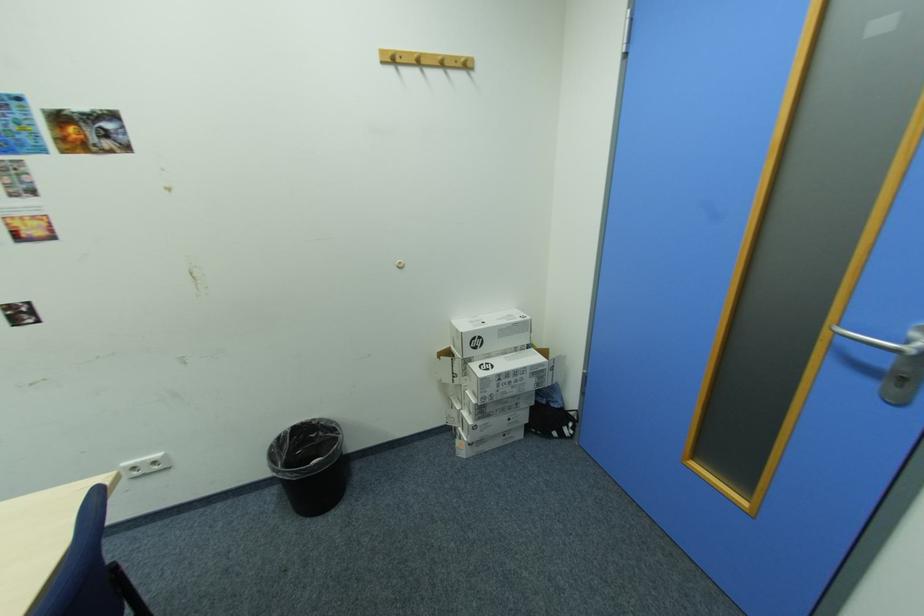
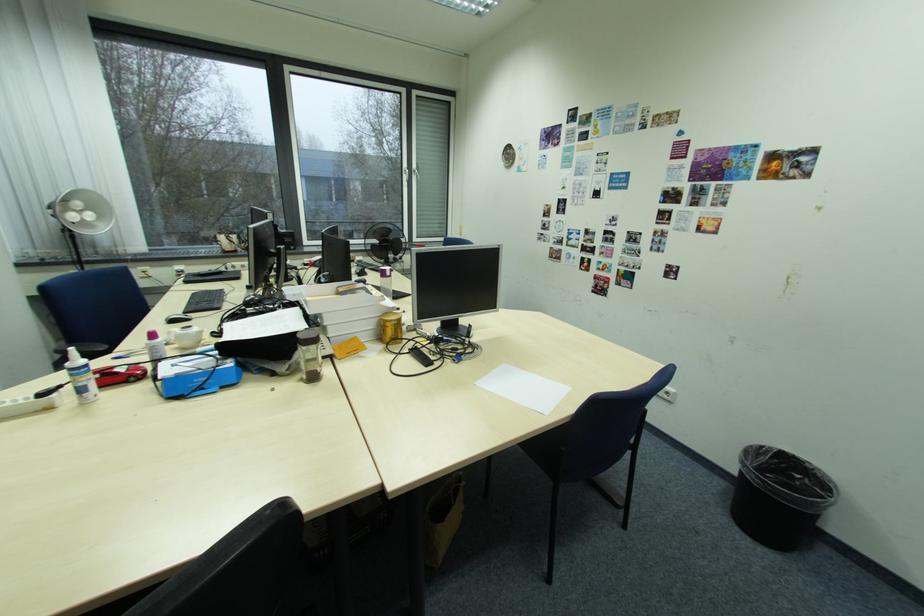
The point at (322, 436) is marked in the first image. Where is the corresponding point in the second image?

(807, 477)